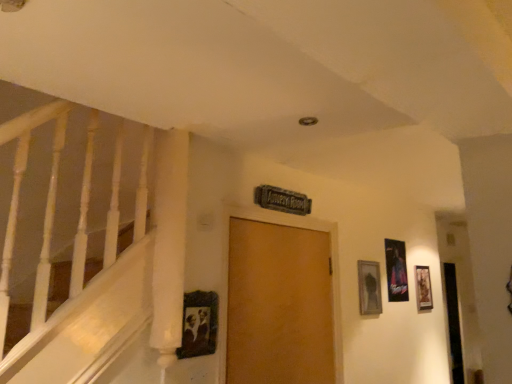
Question: In terms of width, does wooden picture frame at right, which ranks as the first picture frame in right-to-left order, look wider or thinner when compared to metallic silver picture frame at right, the 2th picture frame viewed from the back?

Choices:
 (A) wide
 (B) thin

Answer: (A)

Question: Considering their positions, is wooden picture frame at right, which ranks as the first picture frame in right-to-left order, located in front of or behind metallic silver picture frame at right, the 3th picture frame viewed from the left?

Choices:
 (A) front
 (B) behind

Answer: (B)

Question: Estimate the real-world distances between objects in this image. Which object is closer to the wooden vintage frame at center, acting as the fourth picture frame starting from the right?

Choices:
 (A) metallic silver picture frame at right, the 3th picture frame viewed from the left
 (B) wooden picture frame at right, which ranks as the 1th picture frame in back-to-front order
 (C) wooden picture frame at upper right, the 2th picture frame positioned from the left
 (D) wooden door at center

Answer: (D)

Question: Estimate the real-world distances between objects in this image. Which object is closer to the wooden picture frame at right, which is the fourth picture frame from front to back?

Choices:
 (A) wooden vintage frame at center, acting as the fourth picture frame starting from the right
 (B) metallic silver picture frame at right, the second picture frame in the right-to-left sequence
 (C) wooden picture frame at upper right, the 2th picture frame positioned from the left
 (D) wooden door at center

Answer: (B)